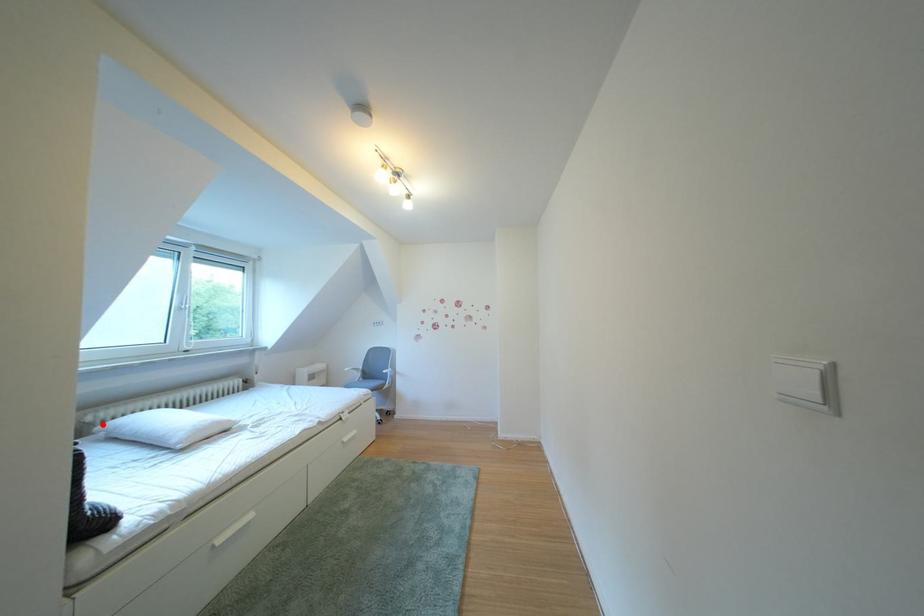
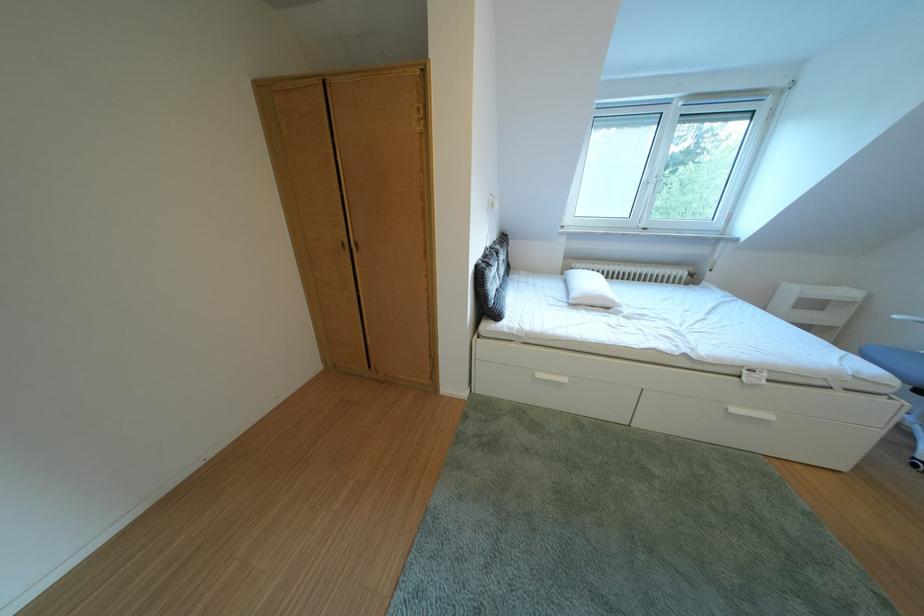
Question: A red point is marked in image1. In image2, is the corresponding 3D point closer to the camera or farther? Reply with the corresponding letter.

Choices:
 (A) The corresponding 3D point is closer.
 (B) The corresponding 3D point is farther.

Answer: (A)